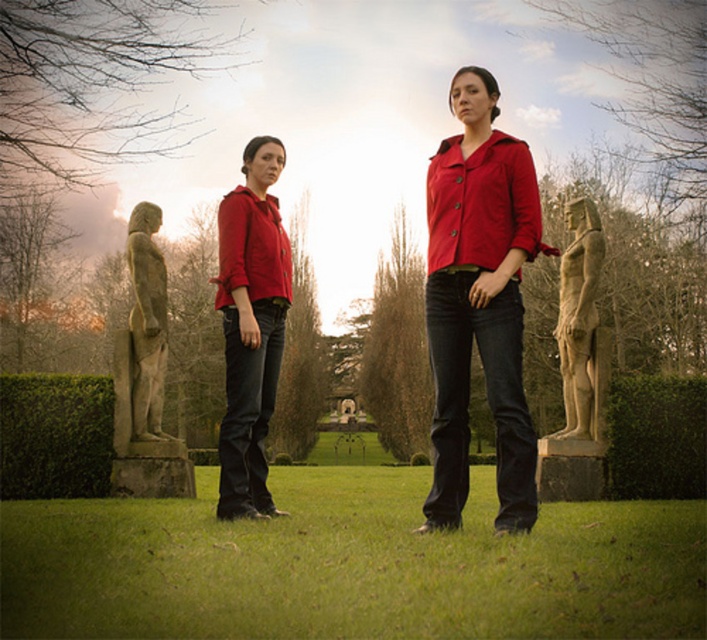
Looking at this image, can you confirm if matte red jacket at center is thinner than stone statue at left?

Yes, matte red jacket at center is thinner than stone statue at left.

Does point (462, 288) come in front of point (163, 474)?

That is True.

Find the location of a particular element. Image resolution: width=707 pixels, height=640 pixels. matte red jacket at center is located at coordinates 479,301.

Who is positioned more to the left, matte red jacket at center or matte red shirt at center?

From the viewer's perspective, matte red shirt at center appears more on the left side.

Which of these two, matte red jacket at center or matte red shirt at center, stands shorter?

matte red jacket at center is shorter.

Between point (450, 211) and point (247, 147), which one is positioned behind?

Positioned behind is point (247, 147).

The height and width of the screenshot is (640, 707). I want to click on matte red jacket at center, so click(479, 301).

Looking at this image, measure the distance from matte red shirt at center to stone statue at left.

matte red shirt at center is 5.57 meters from stone statue at left.

Does matte red shirt at center appear over stone statue at left?

Incorrect, matte red shirt at center is not positioned above stone statue at left.

Which is behind, point (250, 369) or point (146, 467)?

Positioned behind is point (146, 467).

The width and height of the screenshot is (707, 640). Find the location of `matte red shirt at center`. matte red shirt at center is located at coordinates (250, 326).